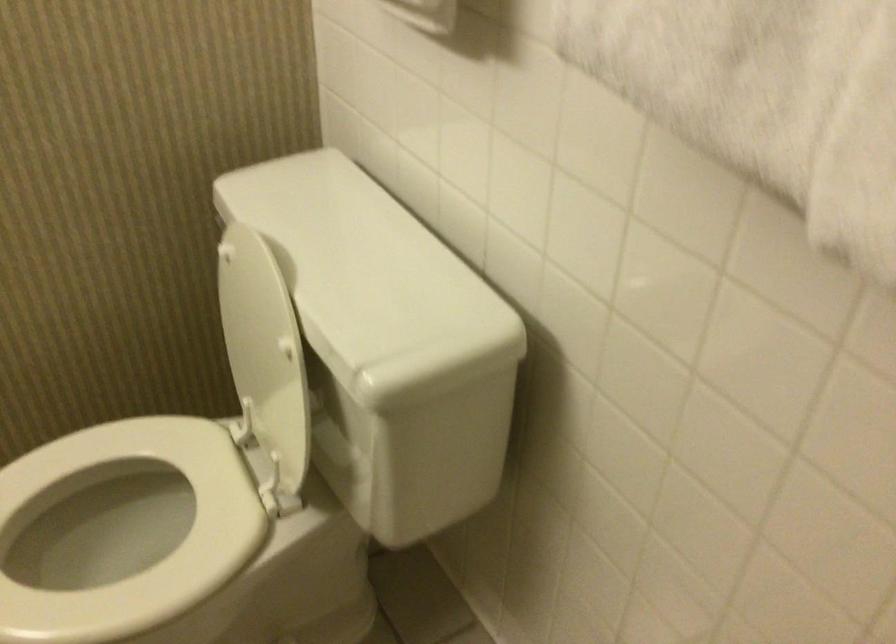
Locate an element on the screen. The height and width of the screenshot is (644, 896). toilet tank lid is located at coordinates (411, 451).